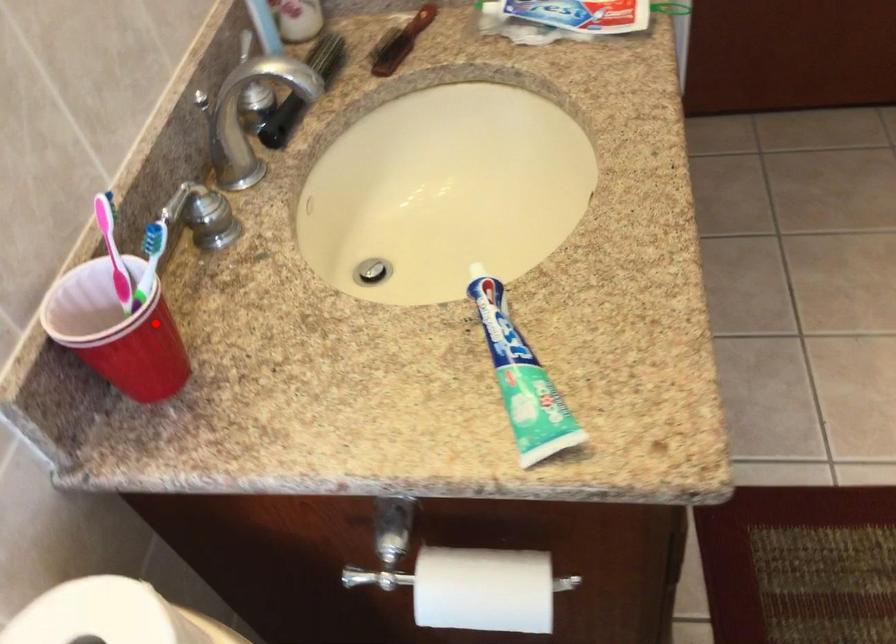
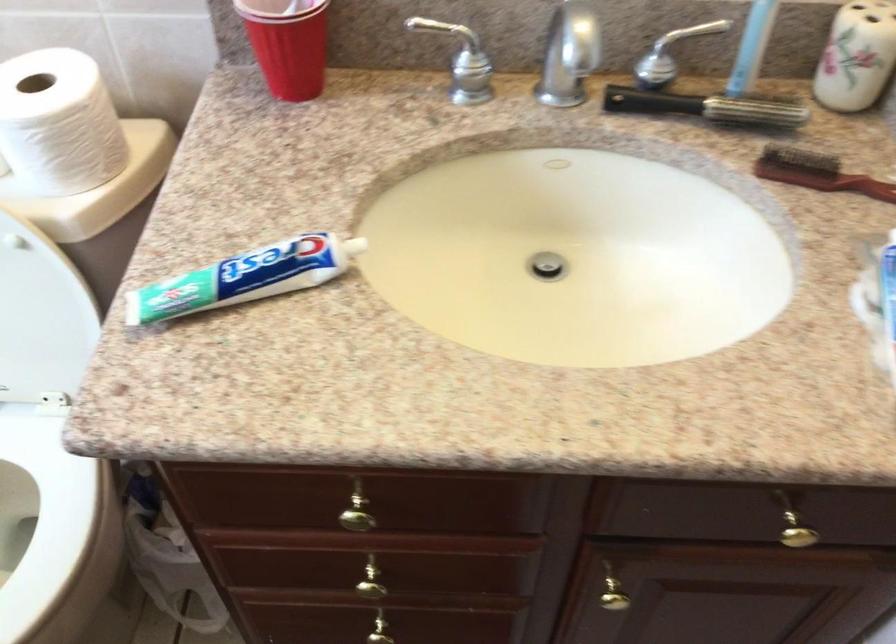
Question: A red point is marked in image1. In image2, is the corresponding 3D point closer to the camera or farther? Reply with the corresponding letter.

Choices:
 (A) The corresponding 3D point is closer.
 (B) The corresponding 3D point is farther.

Answer: (B)